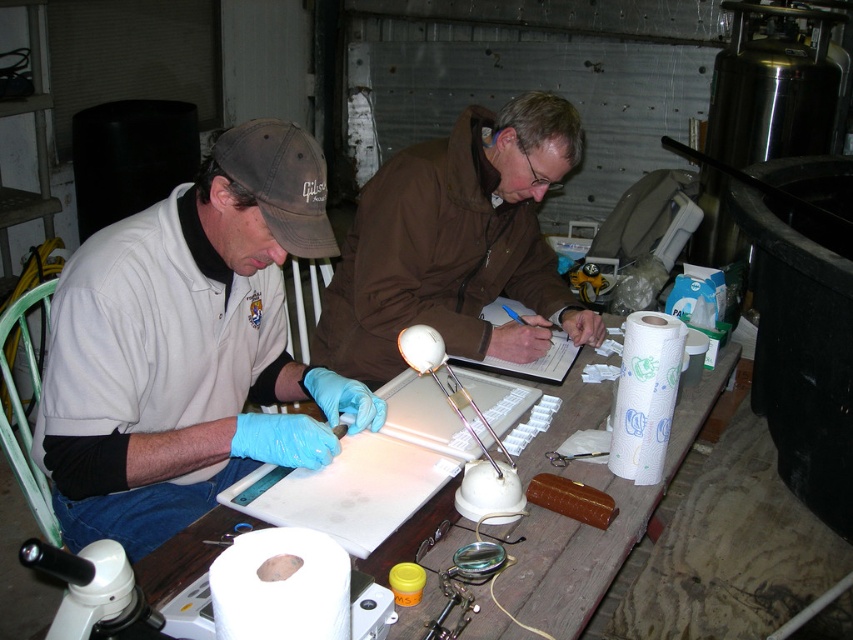
You are a visitor in the workshop and want to place a small tool on the surface between the brown matte jacket at center and the white plastic table at center. Which object should you place the tool closer to to ensure it stays on the surface?

The brown matte jacket at center is much taller than the white plastic table at center, so placing the tool closer to the white plastic table at center ensures it stays on the surface.